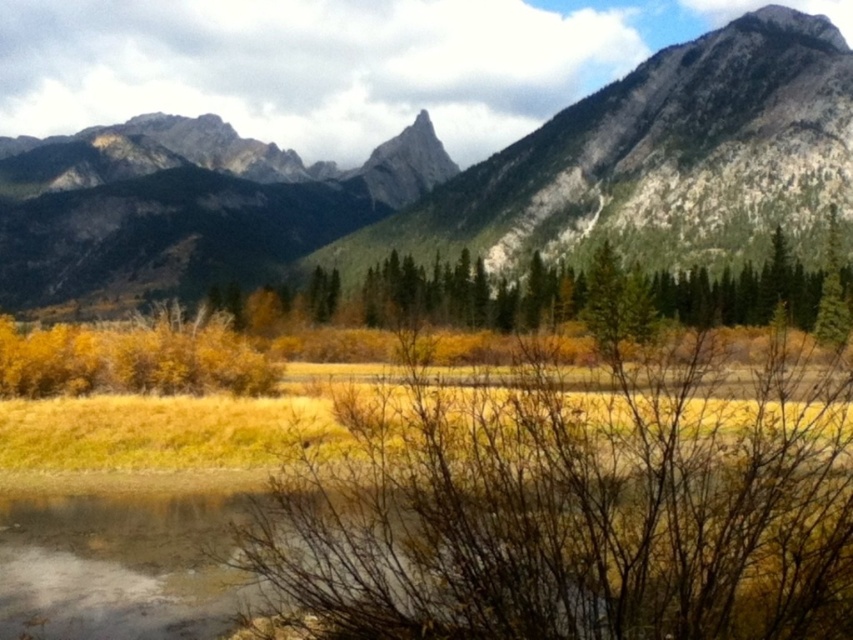
Between point (91, 628) and point (451, 316), which one is positioned behind?

The point (451, 316) is more distant.

You are a GUI agent. You are given a task and a screenshot of the screen. Output one action in this format:
    pyautogui.click(x=<x>, y=<y>)
    Task: Click on the brown dirt at lower left
    
    Given the screenshot: What is the action you would take?
    pyautogui.click(x=120, y=552)

Find the location of a particular element. This screenshot has width=853, height=640. brown dirt at lower left is located at coordinates (120, 552).

Is rocky gray mountain range at upper center shorter than green coniferous trees at center?

No, rocky gray mountain range at upper center is not shorter than green coniferous trees at center.

Who is shorter, rocky gray mountain range at upper center or green coniferous trees at center?

green coniferous trees at center

Between point (399, 240) and point (550, 310), which one is positioned behind?

Point (399, 240)

You are a GUI agent. You are given a task and a screenshot of the screen. Output one action in this format:
    pyautogui.click(x=<x>, y=<y>)
    Task: Click on the rocky gray mountain range at upper center
    The height and width of the screenshot is (640, 853).
    Given the screenshot: What is the action you would take?
    pyautogui.click(x=474, y=180)

Who is more distant from viewer, (450, 198) or (115, 493)?

Point (450, 198)

Describe the element at coordinates (474, 180) in the screenshot. I see `rocky gray mountain range at upper center` at that location.

Which is in front, point (213, 209) or point (103, 582)?

Point (103, 582)

This screenshot has height=640, width=853. In order to click on rocky gray mountain range at upper center in this screenshot , I will do `click(474, 180)`.